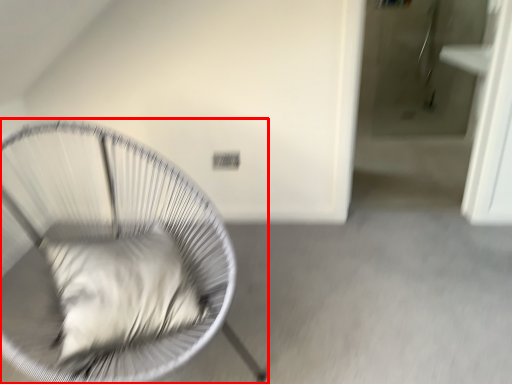
Question: From the image's perspective, what is the correct spatial relationship of furniture (annotated by the red box) in relation to pillow?

Choices:
 (A) below
 (B) above

Answer: (B)